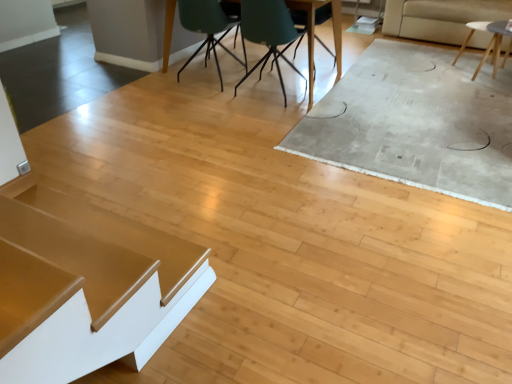
Find the location of `vacant space behind shiny gold table at lower left, acting as the 3th table starting from the back`. vacant space behind shiny gold table at lower left, acting as the 3th table starting from the back is located at coordinates (160, 193).